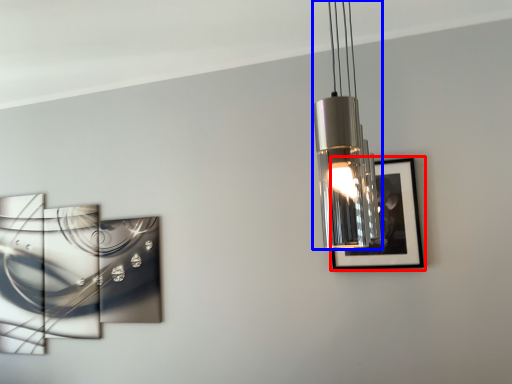
Question: Which point is closer to the camera, picture frame (highlighted by a red box) or lamp (highlighted by a blue box)?

Choices:
 (A) picture frame
 (B) lamp

Answer: (B)